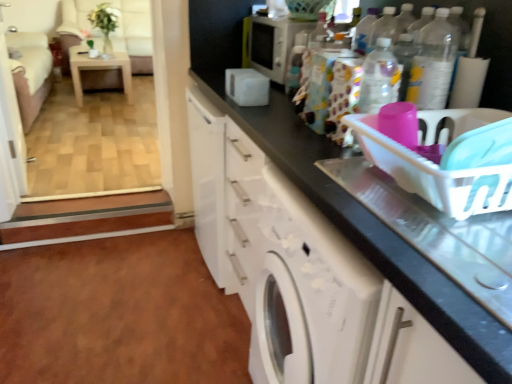
Question: In the image, is white glossy cabinet at lower center positioned in front of or behind white glossy screen door at upper left?

Choices:
 (A) front
 (B) behind

Answer: (A)

Question: Based on their positions, is white glossy cabinet at lower center located to the left or right of white glossy screen door at upper left?

Choices:
 (A) left
 (B) right

Answer: (B)

Question: Estimate the real-world distances between objects in this image. Which object is closer to the brown laminate floor at lower left?

Choices:
 (A) white glossy table at upper left
 (B) white glossy microwave at upper center
 (C) beige fabric armchair at upper left
 (D) white plastic basket at right
 (E) white glossy washing machine at center

Answer: (E)

Question: Based on their relative distances, which object is farther from the white plastic basket at right?

Choices:
 (A) white glossy screen door at upper left
 (B) patterned fabric bag at upper center, acting as the 2th bottle starting from the right
 (C) white glossy microwave at upper center
 (D) brown laminate floor at lower left
 (E) white glossy cabinet at lower center

Answer: (A)